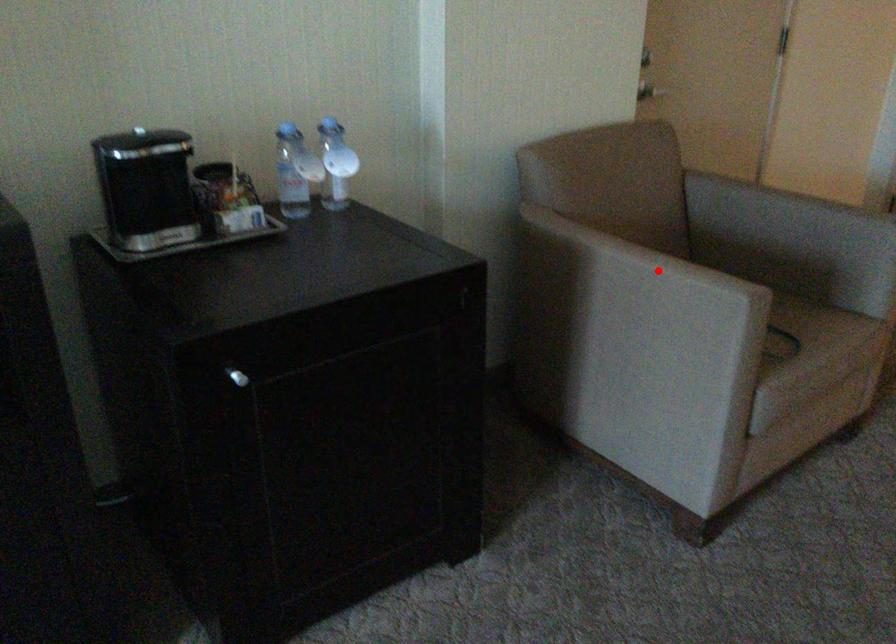
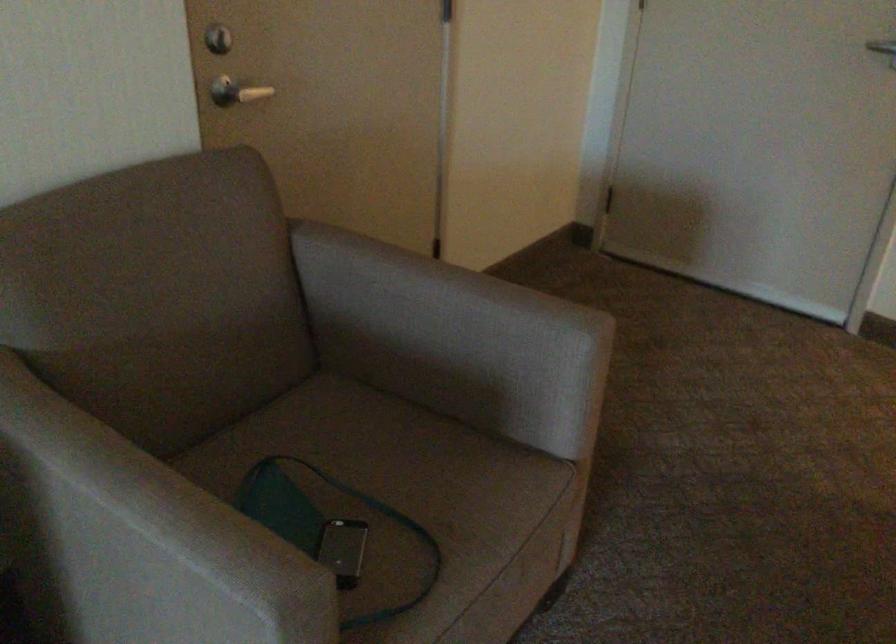
Question: I am providing you with two images of the same scene from different viewpoints. Image1 has a red point marked. In image2, the corresponding 3D location appears at what relative position? Reply with the corresponding letter.

Choices:
 (A) Closer
 (B) Farther

Answer: (A)